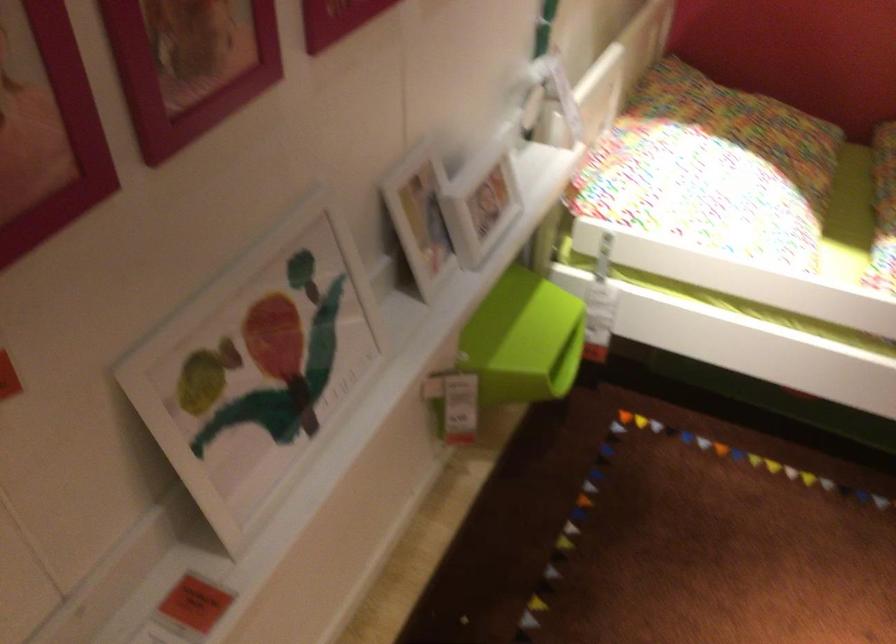
Where would you lift the patterned pillow? Please return your answer as a coordinate pair (x, y).

(712, 169)